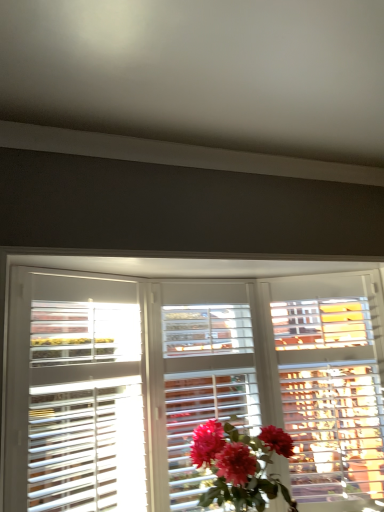
Question: Does matte pink petals at center have a larger size compared to white wooden blinds at center?

Choices:
 (A) no
 (B) yes

Answer: (A)

Question: Does matte pink petals at center lie behind white wooden blinds at center?

Choices:
 (A) yes
 (B) no

Answer: (A)

Question: Is matte pink petals at center wider than white wooden blinds at center?

Choices:
 (A) yes
 (B) no

Answer: (B)

Question: Is matte pink petals at center closer to the viewer compared to white wooden blinds at center?

Choices:
 (A) no
 (B) yes

Answer: (A)

Question: From a real-world perspective, is matte pink petals at center positioned under white wooden blinds at center based on gravity?

Choices:
 (A) yes
 (B) no

Answer: (A)

Question: Is matte pink petals at center at the right side of white wooden blinds at center?

Choices:
 (A) no
 (B) yes

Answer: (B)

Question: Considering the relative positions of white wooden blinds at center and matte pink petals at center in the image provided, is white wooden blinds at center in front of matte pink petals at center?

Choices:
 (A) no
 (B) yes

Answer: (B)

Question: From the image's perspective, is white wooden blinds at center located above matte pink petals at center?

Choices:
 (A) no
 (B) yes

Answer: (B)

Question: From the image's perspective, is white wooden blinds at center below matte pink petals at center?

Choices:
 (A) no
 (B) yes

Answer: (A)

Question: Is white wooden blinds at center shorter than matte pink petals at center?

Choices:
 (A) yes
 (B) no

Answer: (B)

Question: Is white wooden blinds at center smaller than matte pink petals at center?

Choices:
 (A) no
 (B) yes

Answer: (A)

Question: Is white wooden blinds at center not close to matte pink petals at center?

Choices:
 (A) yes
 (B) no

Answer: (B)

Question: Is matte pink petals at center taller or shorter than white wooden blinds at center?

Choices:
 (A) tall
 (B) short

Answer: (B)